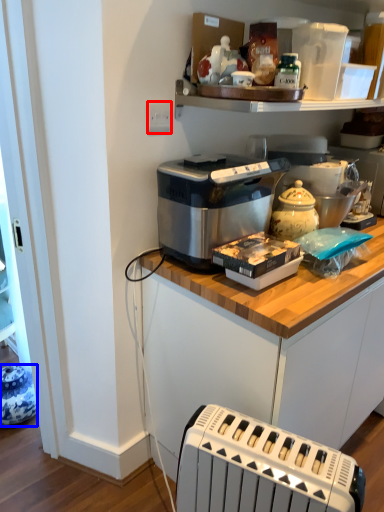
Question: Which of the following is the farthest to the observer, electric outlet (highlighted by a red box) or appliance (highlighted by a blue box)?

Choices:
 (A) electric outlet
 (B) appliance

Answer: (B)